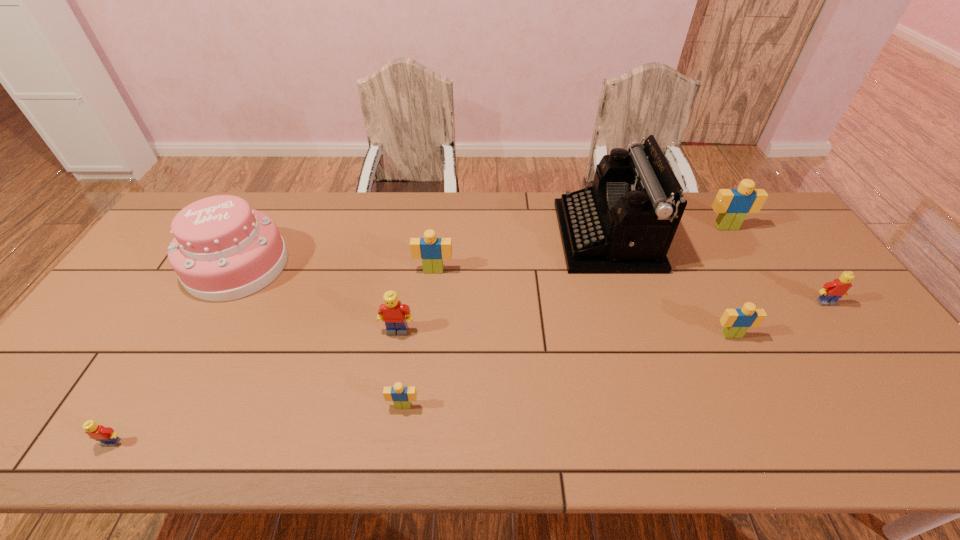
The height and width of the screenshot is (540, 960). I want to click on typewriter, so click(624, 223).

This screenshot has width=960, height=540. What are the coordinates of `the fourth object from right to left` in the screenshot? It's located at (624, 223).

In order to click on pink birthday cake in this screenshot , I will do `click(223, 250)`.

Locate an element on the screen. The width and height of the screenshot is (960, 540). the farthest Lego is located at coordinates (732, 205).

Where is `the tallest Lego`? the tallest Lego is located at coordinates (732, 205).

I want to click on the sixth nearest Lego, so click(432, 250).

Locate an element on the screen. Image resolution: width=960 pixels, height=540 pixels. the second farthest beige Lego is located at coordinates (432, 250).

At what (x,y) coordinates should I click in order to perform the action: click on the biggest yellow Lego. Please return your answer as a coordinate pair (x, y). Looking at the image, I should click on (392, 313).

Locate an element on the screen. the second nearest yellow Lego is located at coordinates (392, 313).

Where is `the fifth Lego from left to right`? This screenshot has height=540, width=960. the fifth Lego from left to right is located at coordinates (736, 322).